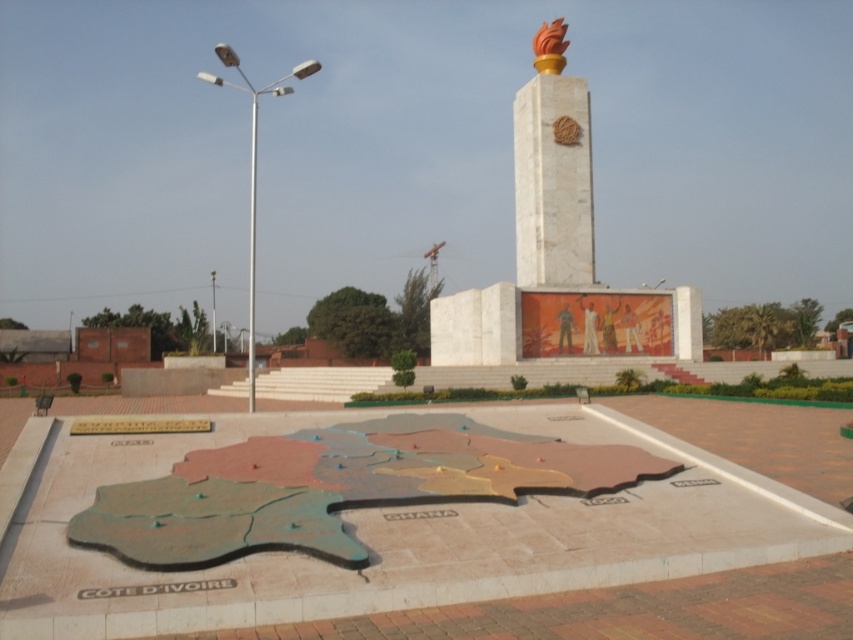
Question: Among these points, which one is farthest from the camera?

Choices:
 (A) (589, 145)
 (B) (573, 192)

Answer: (A)

Question: Which point is farther to the camera?

Choices:
 (A) tap(538, 205)
 (B) tap(590, 141)

Answer: (B)

Question: Does white marble monument at center appear on the right side of white marble obelisk at upper center?

Choices:
 (A) no
 (B) yes

Answer: (B)

Question: Is white marble monument at center below white marble obelisk at upper center?

Choices:
 (A) yes
 (B) no

Answer: (A)

Question: Is white marble monument at center bigger than white marble obelisk at upper center?

Choices:
 (A) no
 (B) yes

Answer: (B)

Question: Which of the following is the farthest from the observer?

Choices:
 (A) (576, 292)
 (B) (573, 108)

Answer: (B)